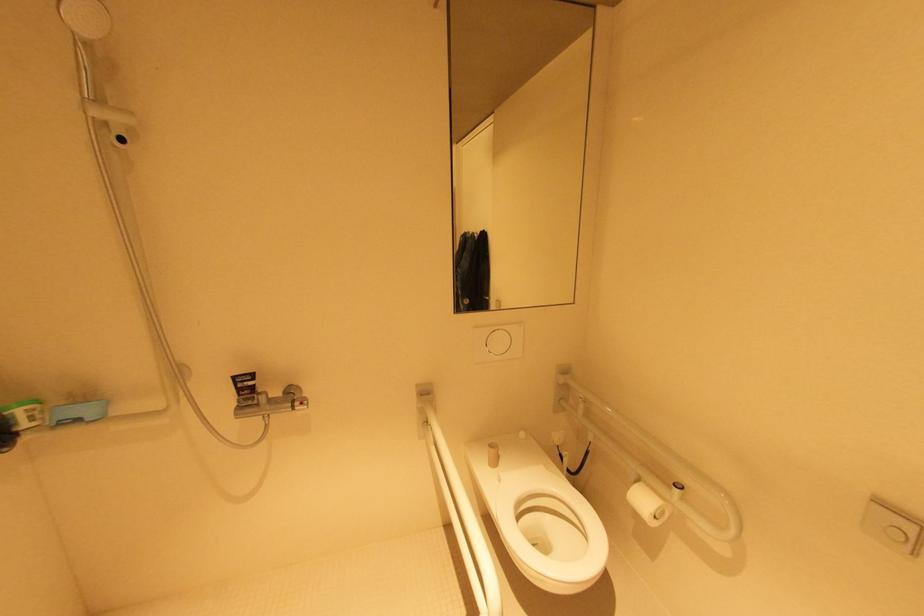
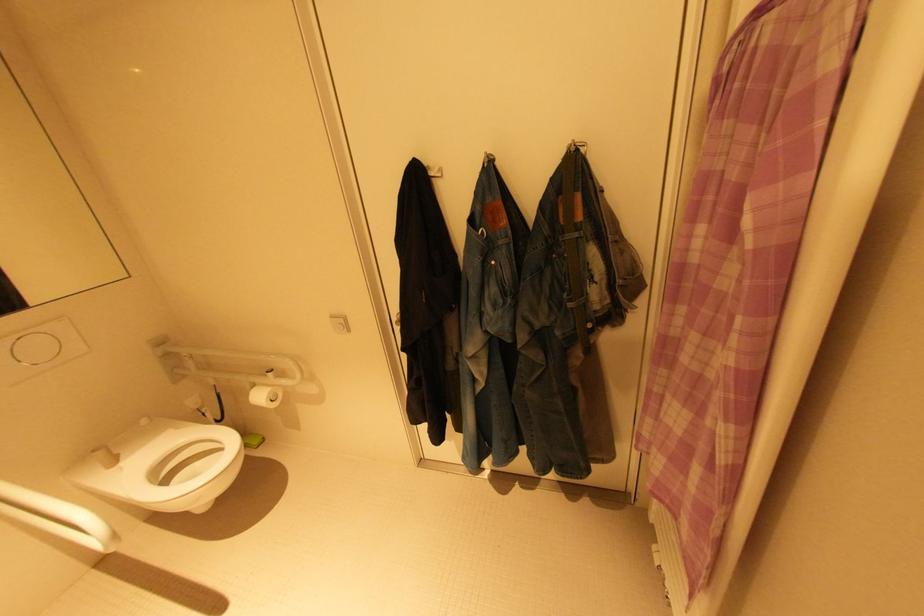
Based on the continuous images, in which direction is the camera rotating?

The camera's rotation is toward right-down.